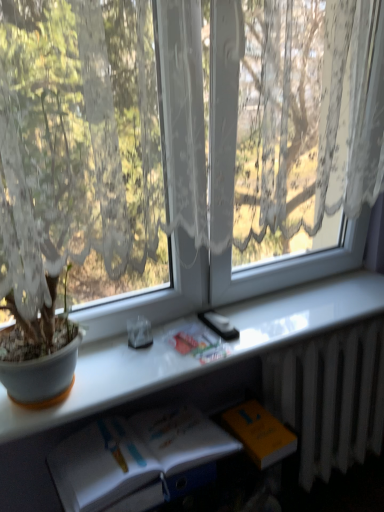
The image size is (384, 512). What do you see at coordinates (198, 343) in the screenshot?
I see `matte plastic book at center, marked as the 2th book in a bottom-to-top arrangement` at bounding box center [198, 343].

How much space does white paper book at lower center, positioned as the second book in top-to-bottom order, occupy vertically?

It is 4.42 inches.

At what (x,y) coordinates should I click in order to perform the action: click on matte plastic book at center, arranged as the 1th book when viewed from the top. Please return your answer as a coordinate pair (x, y). This screenshot has width=384, height=512. Looking at the image, I should click on (198, 343).

Find the location of a particular element. The image size is (384, 512). radiator that appears below the matte plastic book at center, marked as the 2th book in a bottom-to-top arrangement (from a real-world perspective) is located at coordinates (330, 396).

Based on the photo, considering their positions, is matte plastic book at center, marked as the 2th book in a bottom-to-top arrangement, located in front of or behind white metallic radiator at lower right?

Clearly, matte plastic book at center, marked as the 2th book in a bottom-to-top arrangement, is in front of white metallic radiator at lower right.

Is point (187, 338) in front of point (329, 375)?

That is True.

From a real-world perspective, is matte plastic book at center, arranged as the 1th book when viewed from the top, positioned under white metallic radiator at lower right based on gravity?

No, from a real-world perspective, matte plastic book at center, arranged as the 1th book when viewed from the top, is not under white metallic radiator at lower right.

Is white metallic radiator at lower right positioned far away from white glossy book at lower center?

white metallic radiator at lower right is actually quite close to white glossy book at lower center.

Choose the correct answer: Is white metallic radiator at lower right inside white glossy book at lower center or outside it?

white metallic radiator at lower right is not enclosed by white glossy book at lower center.

From a real-world perspective, is white metallic radiator at lower right positioned over white glossy book at lower center based on gravity?

No.

In order to click on paperback book on the right of the white paper book at lower center, positioned as the second book in top-to-bottom order in this screenshot , I will do `click(260, 433)`.

From the image's perspective, is white paper book at lower center, positioned as the second book in top-to-bottom order, on top of orange matte paperback book at lower right?

No, from the image's perspective, white paper book at lower center, positioned as the second book in top-to-bottom order, is not over orange matte paperback book at lower right.

Considering the relative sizes of white paper book at lower center, acting as the 1th book starting from the bottom, and orange matte paperback book at lower right in the image provided, is white paper book at lower center, acting as the 1th book starting from the bottom, wider than orange matte paperback book at lower right?

Correct, the width of white paper book at lower center, acting as the 1th book starting from the bottom, exceeds that of orange matte paperback book at lower right.

From the image's perspective, is transparent lace curtain at upper center over white glossy book at lower center?

Correct, transparent lace curtain at upper center appears higher than white glossy book at lower center in the image.

Which is more to the left, transparent lace curtain at upper center or white glossy book at lower center?

transparent lace curtain at upper center.

Is transparent lace curtain at upper center not near white glossy book at lower center?

No, transparent lace curtain at upper center is not far away from white glossy book at lower center.

How distant is transparent lace curtain at upper center from white glossy book at lower center?

The distance of transparent lace curtain at upper center from white glossy book at lower center is 52.03 centimeters.

Which is correct: white paper book at lower center, positioned as the second book in top-to-bottom order, is inside matte plastic book at center, arranged as the 1th book when viewed from the top, or outside of it?

white paper book at lower center, positioned as the second book in top-to-bottom order, exists outside the volume of matte plastic book at center, arranged as the 1th book when viewed from the top.

Looking at their sizes, would you say white paper book at lower center, positioned as the second book in top-to-bottom order, is wider or thinner than matte plastic book at center, arranged as the 1th book when viewed from the top?

white paper book at lower center, positioned as the second book in top-to-bottom order, is wider than matte plastic book at center, arranged as the 1th book when viewed from the top.

Measure the distance from white paper book at lower center, acting as the 1th book starting from the bottom, to matte plastic book at center, marked as the 2th book in a bottom-to-top arrangement.

white paper book at lower center, acting as the 1th book starting from the bottom, is 10.41 inches away from matte plastic book at center, marked as the 2th book in a bottom-to-top arrangement.

Which of these two, white paper book at lower center, positioned as the second book in top-to-bottom order, or matte plastic book at center, arranged as the 1th book when viewed from the top, stands shorter?

matte plastic book at center, arranged as the 1th book when viewed from the top, is shorter.

You are a GUI agent. You are given a task and a screenshot of the screen. Output one action in this format:
    pyautogui.click(x=<x>, y=<y>)
    Task: Click on the paperback book below the matte plastic book at center, marked as the 2th book in a bottom-to-top arrangement (from the image's perspective)
    
    Given the screenshot: What is the action you would take?
    pyautogui.click(x=260, y=433)

Which object is positioned more to the left, matte plastic book at center, marked as the 2th book in a bottom-to-top arrangement, or orange matte paperback book at lower right?

From the viewer's perspective, matte plastic book at center, marked as the 2th book in a bottom-to-top arrangement, appears more on the left side.

Considering the positions of point (227, 348) and point (275, 439), is point (227, 348) closer or farther from the camera than point (275, 439)?

Clearly, point (227, 348) is closer to the camera than point (275, 439).

Does matte plastic book at center, marked as the 2th book in a bottom-to-top arrangement, have a greater height compared to orange matte paperback book at lower right?

No, matte plastic book at center, marked as the 2th book in a bottom-to-top arrangement, is not taller than orange matte paperback book at lower right.

Is white metallic radiator at lower right not within matte plastic book at center, arranged as the 1th book when viewed from the top?

Yes, white metallic radiator at lower right is not within matte plastic book at center, arranged as the 1th book when viewed from the top.

Considering the sizes of objects white metallic radiator at lower right and matte plastic book at center, marked as the 2th book in a bottom-to-top arrangement, in the image provided, who is smaller, white metallic radiator at lower right or matte plastic book at center, marked as the 2th book in a bottom-to-top arrangement,?

matte plastic book at center, marked as the 2th book in a bottom-to-top arrangement.

Considering the relative positions of white metallic radiator at lower right and matte plastic book at center, marked as the 2th book in a bottom-to-top arrangement, in the image provided, is white metallic radiator at lower right behind matte plastic book at center, marked as the 2th book in a bottom-to-top arrangement,?

Yes, it is.

Is there a large distance between white metallic radiator at lower right and matte plastic book at center, arranged as the 1th book when viewed from the top?

Actually, white metallic radiator at lower right and matte plastic book at center, arranged as the 1th book when viewed from the top, are a little close together.

This screenshot has width=384, height=512. What are the coordinates of `radiator below the matte plastic book at center, marked as the 2th book in a bottom-to-top arrangement (from the image's perspective)` in the screenshot? It's located at (330, 396).

Find the location of a particular element. This screenshot has height=512, width=384. radiator on the right of white glossy book at lower center is located at coordinates (330, 396).

Looking at the image, which one is located further to transparent lace curtain at upper center, white paper book at lower center, positioned as the second book in top-to-bottom order, or matte plastic book at center, marked as the 2th book in a bottom-to-top arrangement?

Among the two, white paper book at lower center, positioned as the second book in top-to-bottom order, is located further to transparent lace curtain at upper center.

Based on their spatial positions, is transparent lace curtain at upper center or white metallic radiator at lower right further from matte plastic book at center, arranged as the 1th book when viewed from the top?

transparent lace curtain at upper center lies further to matte plastic book at center, arranged as the 1th book when viewed from the top, than the other object.

Based on their spatial positions, is white metallic radiator at lower right or transparent lace curtain at upper center further from white glossy book at lower center?

transparent lace curtain at upper center is positioned further to the anchor white glossy book at lower center.

Based on their spatial positions, is white metallic radiator at lower right or matte plastic book at center, marked as the 2th book in a bottom-to-top arrangement, further from white paper book at lower center, acting as the 1th book starting from the bottom?

Among the two, white metallic radiator at lower right is located further to white paper book at lower center, acting as the 1th book starting from the bottom.

When comparing their distances from transparent lace curtain at upper center, does white paper book at lower center, acting as the 1th book starting from the bottom, or white metallic radiator at lower right seem further?

white metallic radiator at lower right.

From the image, which object appears to be farther from white metallic radiator at lower right, matte plastic book at center, marked as the 2th book in a bottom-to-top arrangement, or orange matte paperback book at lower right?

The object further to white metallic radiator at lower right is matte plastic book at center, marked as the 2th book in a bottom-to-top arrangement.

Which object lies nearer to the anchor point white paper book at lower center, positioned as the second book in top-to-bottom order, white glossy book at lower center or white metallic radiator at lower right?

white glossy book at lower center is closer to white paper book at lower center, positioned as the second book in top-to-bottom order.

Which object lies further to the anchor point white paper book at lower center, acting as the 1th book starting from the bottom, white metallic radiator at lower right or white glossy book at lower center?

Among the two, white metallic radiator at lower right is located further to white paper book at lower center, acting as the 1th book starting from the bottom.

Locate an element on the screen. paperback book that lies between transparent lace curtain at upper center and white paper book at lower center, positioned as the second book in top-to-bottom order, from top to bottom is located at coordinates (260, 433).

Find the location of a particular element. computer desk between matte plastic book at center, marked as the 2th book in a bottom-to-top arrangement, and orange matte paperback book at lower right from top to bottom is located at coordinates (230, 383).

Locate an element on the screen. Image resolution: width=384 pixels, height=512 pixels. paperback book between white glossy book at lower center and white paper book at lower center, positioned as the second book in top-to-bottom order, vertically is located at coordinates (260, 433).

Find the location of a particular element. This screenshot has height=512, width=384. book between transparent lace curtain at upper center and white paper book at lower center, acting as the 1th book starting from the bottom, in the up-down direction is located at coordinates (198, 343).